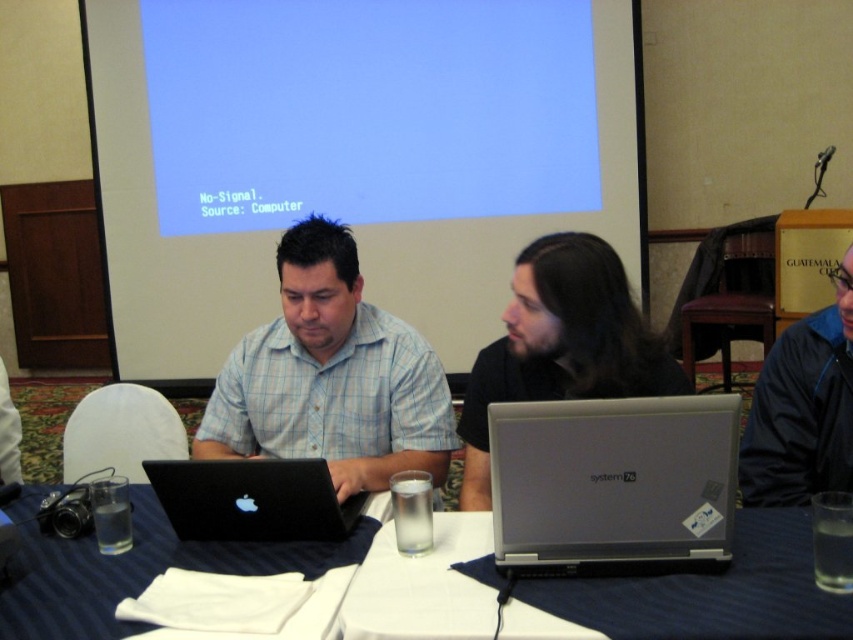
Is matte black shirt at center below blue fleece jacket at right?

Indeed, matte black shirt at center is positioned under blue fleece jacket at right.

Between point (340, 394) and point (807, 408), which one is positioned in front?

Point (807, 408)

Find the location of a particular element. This screenshot has height=640, width=853. matte black shirt at center is located at coordinates (331, 376).

Between silver metallic laptop at center and blue fleece jacket at right, which one appears on the left side from the viewer's perspective?

From the viewer's perspective, silver metallic laptop at center appears more on the left side.

From the picture: Can you confirm if silver metallic laptop at center is smaller than blue fleece jacket at right?

Indeed, silver metallic laptop at center has a smaller size compared to blue fleece jacket at right.

This screenshot has width=853, height=640. Describe the element at coordinates (613, 483) in the screenshot. I see `silver metallic laptop at center` at that location.

In order to click on silver metallic laptop at center in this screenshot , I will do `click(613, 483)`.

Measure the distance between blue fleece jacket at right and black matte laptop at center.

blue fleece jacket at right is 38.28 inches away from black matte laptop at center.

The height and width of the screenshot is (640, 853). In order to click on blue fleece jacket at right in this screenshot , I will do `click(804, 406)`.

Identify the location of blue fleece jacket at right. The image size is (853, 640). (804, 406).